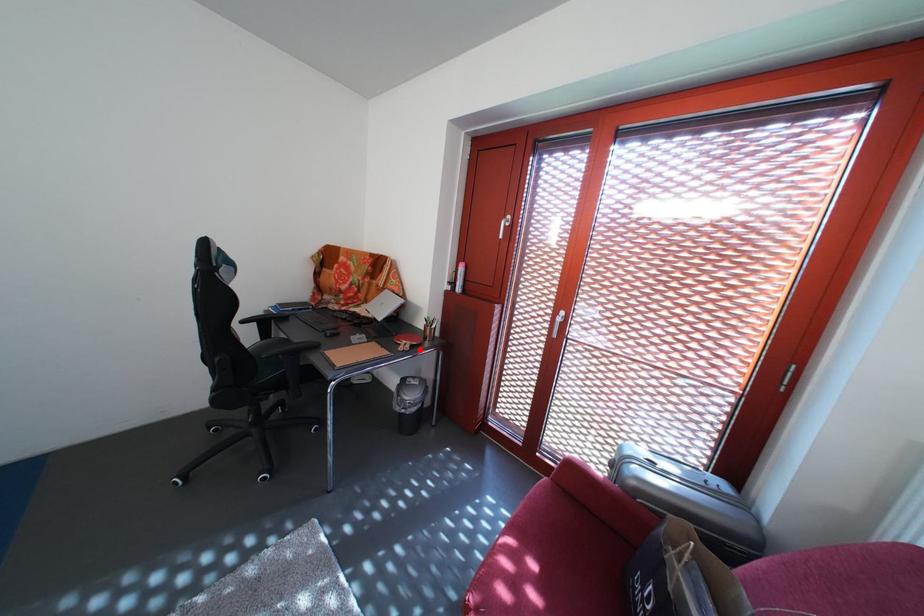
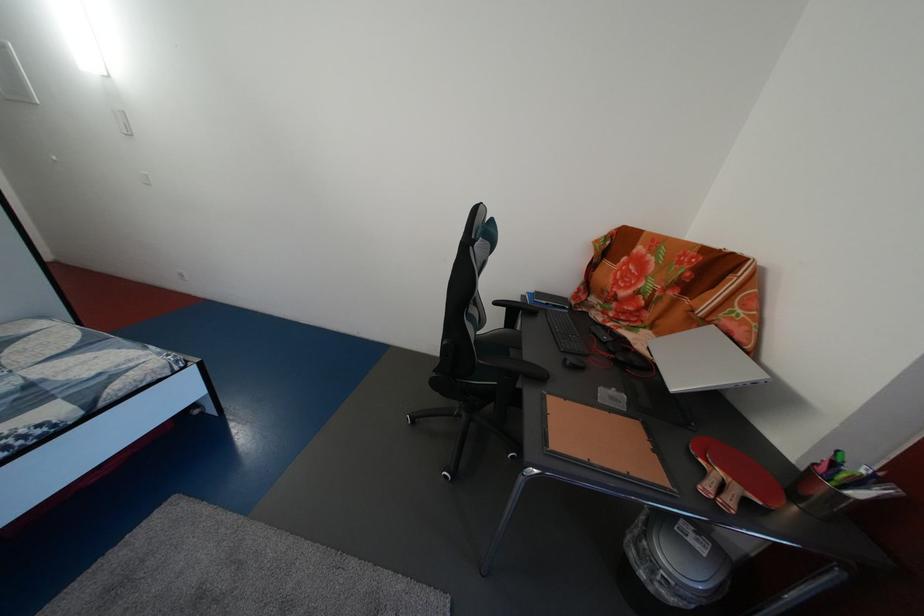
Where in the second image is the point corresponding to the highlighted location from the first image?

(748, 496)